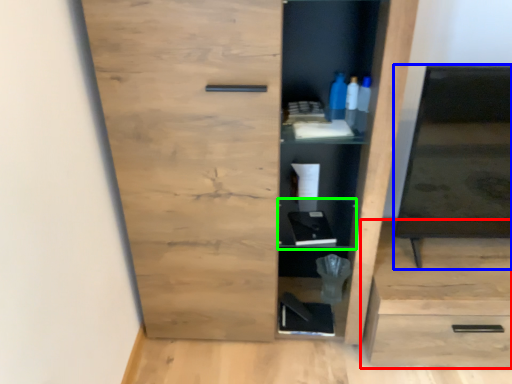
Question: Based on their relative distances, which object is nearer to cabinetry (highlighted by a red box)? Choose from medicine cabinet (highlighted by a blue box) and cabinet (highlighted by a green box).

Choices:
 (A) medicine cabinet
 (B) cabinet

Answer: (A)